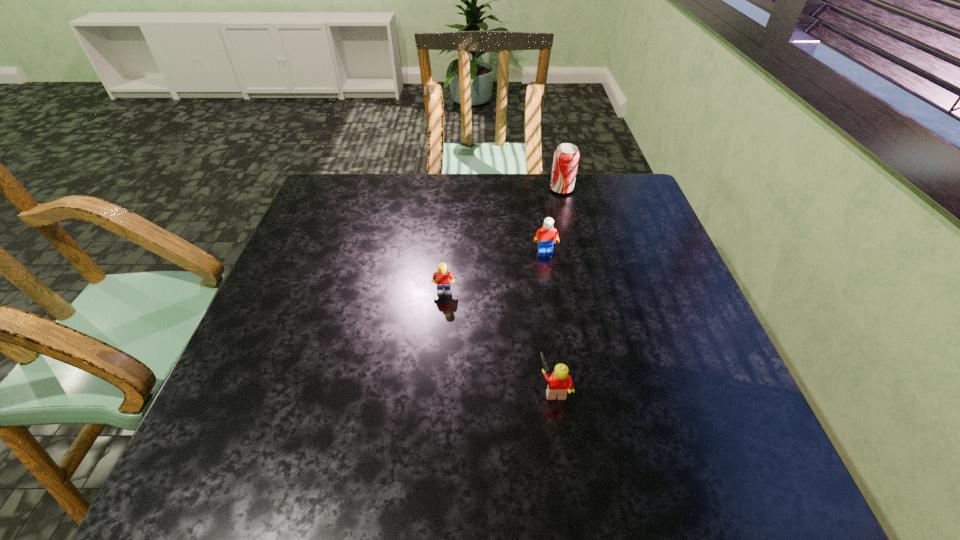
Locate an element on the screen. The image size is (960, 540). vacant space at the far right corner is located at coordinates (626, 217).

Where is `vacant area between the leftmost Lego and the rightmost object`? vacant area between the leftmost Lego and the rightmost object is located at coordinates (503, 240).

Locate an element on the screen. This screenshot has height=540, width=960. vacant area that lies between the leftmost object and the tallest object is located at coordinates (503, 240).

Where is `empty space that is in between the third nearest object and the nearest Lego`? This screenshot has height=540, width=960. empty space that is in between the third nearest object and the nearest Lego is located at coordinates (550, 319).

At what (x,y) coordinates should I click in order to perform the action: click on free space between the farthest Lego and the nearest Lego. Please return your answer as a coordinate pair (x, y). Image resolution: width=960 pixels, height=540 pixels. Looking at the image, I should click on (550, 319).

The image size is (960, 540). I want to click on empty location between the second nearest Lego and the third nearest object, so click(x=494, y=271).

Image resolution: width=960 pixels, height=540 pixels. I want to click on vacant space in between the leftmost Lego and the nearest object, so click(x=499, y=340).

You are a GUI agent. You are given a task and a screenshot of the screen. Output one action in this format:
    pyautogui.click(x=<x>, y=<y>)
    Task: Click on the vacant area between the rightmost object and the leftmost object
    The height and width of the screenshot is (540, 960).
    Given the screenshot: What is the action you would take?
    pyautogui.click(x=503, y=240)

You are a GUI agent. You are given a task and a screenshot of the screen. Output one action in this format:
    pyautogui.click(x=<x>, y=<y>)
    Task: Click on the vacant area that lies between the third nearest object and the nearest object
    This screenshot has height=540, width=960.
    Given the screenshot: What is the action you would take?
    pyautogui.click(x=550, y=319)

Find the location of a particular element. The width and height of the screenshot is (960, 540). empty location between the leftmost object and the second farthest object is located at coordinates (494, 271).